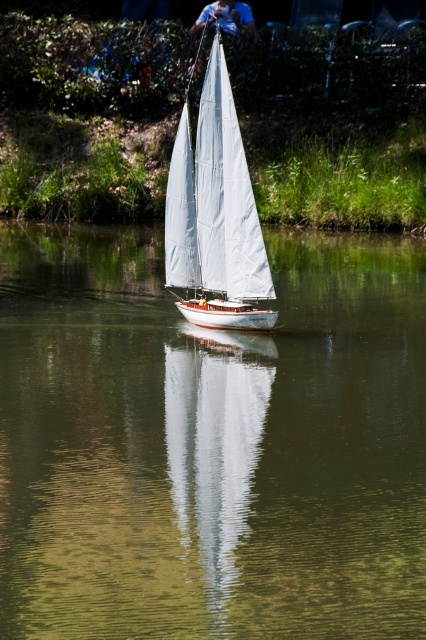
You are an observer standing on the shore looking at the scene. The green reflective water at center and the white canvas sailboat at center are both in your view. Which object is located below the other?

The green reflective water at center is positioned under the white canvas sailboat at center, so the water is below the sailboat.

You are a photographer trying to capture the reflection of the sailboat in the water. You notice a point at coordinates point (x=210, y=444). Where is this point located in the scene?

The point (x=210, y=444) is on the green reflective water at center, which is where the reflection of the sailboat would be visible.

You are standing on the deck of the sailboat and looking at two points in the water. The first point is at coordinates point (74, 240) and the second point is at point (204, 168). Which point is closer to you?

Point (74, 240) is further to the camera than point (204, 168), so the second point is closer to you.